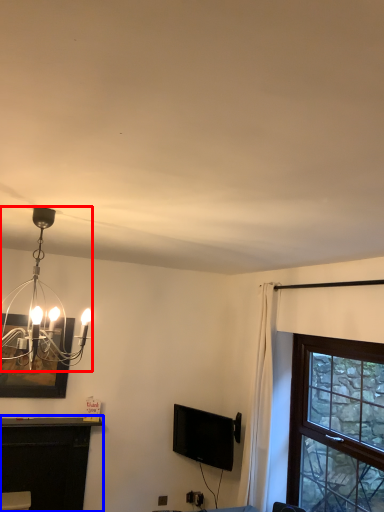
Question: Which of the following is the closest to the observer, lamp (highlighted by a red box) or table (highlighted by a blue box)?

Choices:
 (A) lamp
 (B) table

Answer: (A)